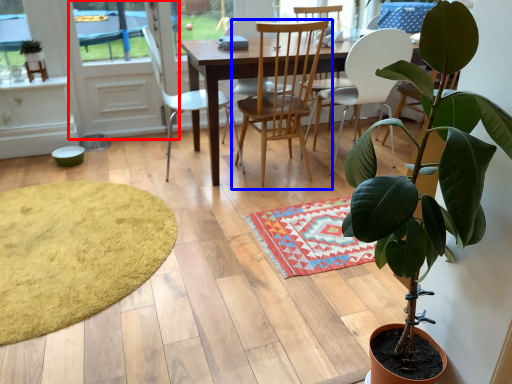
Question: Which point is closer to the camera, screen door (highlighted by a red box) or chair (highlighted by a blue box)?

Choices:
 (A) screen door
 (B) chair

Answer: (B)